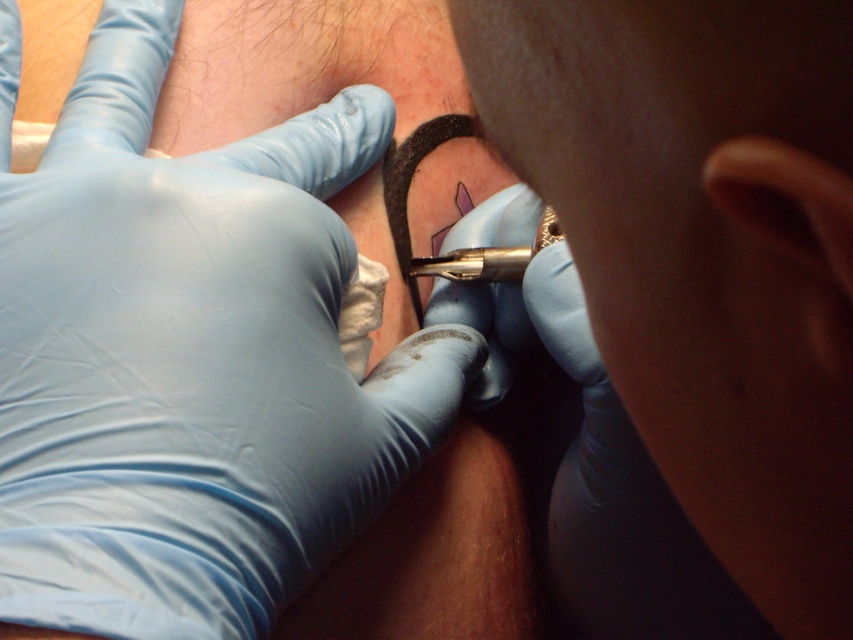
Question: Can you confirm if blue rubber glove at upper left is positioned above blue rubber glove at center?

Choices:
 (A) yes
 (B) no

Answer: (A)

Question: From the image, what is the correct spatial relationship of blue rubber glove at upper left in relation to blue rubber glove at center?

Choices:
 (A) below
 (B) above

Answer: (B)

Question: Is the position of blue rubber glove at upper left less distant than that of blue rubber glove at center?

Choices:
 (A) yes
 (B) no

Answer: (A)

Question: Which of the following is the closest to the observer?

Choices:
 (A) blue rubber glove at center
 (B) blue rubber glove at upper left

Answer: (B)